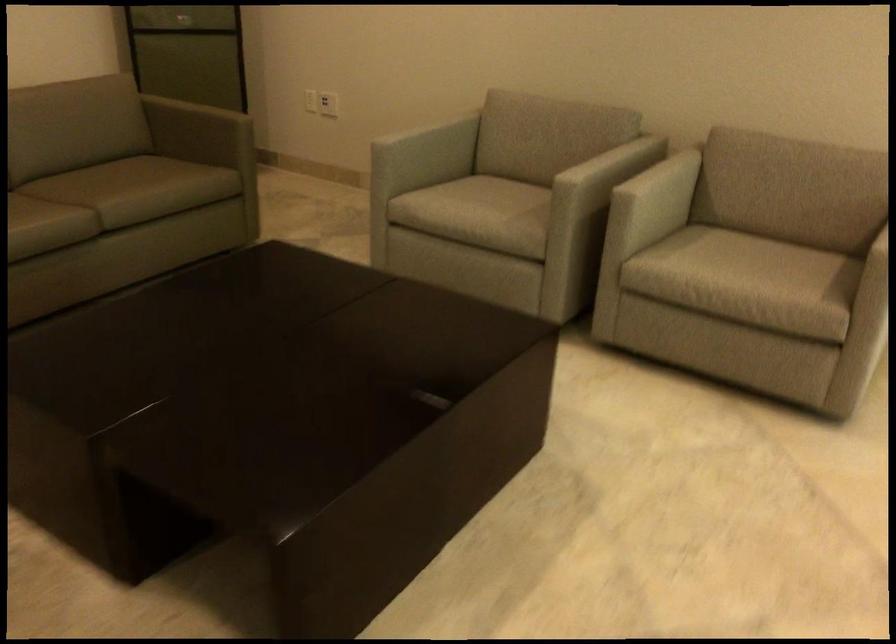
Where would you plugging in the white electrical outlet? Please return your answer as a coordinate pair (x, y).

(328, 104)